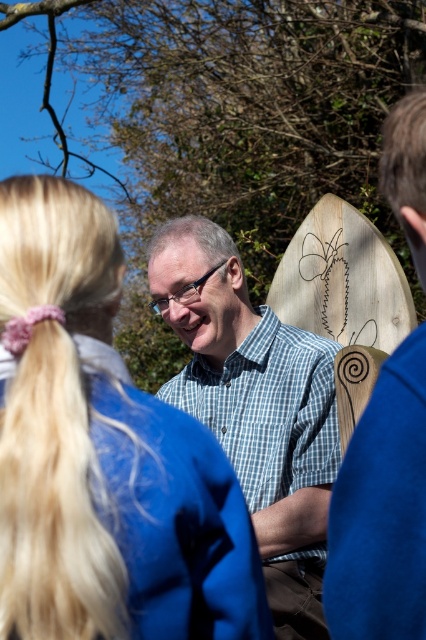
Does point (138, 604) lie behind point (397, 186)?

No, it is in front of (397, 186).

At what (x,y) coordinates should I click in order to perform the action: click on blue fabric at center. Please return your answer as a coordinate pair (x, y). The width and height of the screenshot is (426, 640). Looking at the image, I should click on (103, 454).

The image size is (426, 640). What do you see at coordinates (103, 454) in the screenshot?
I see `blue fabric at center` at bounding box center [103, 454].

Where is `blue fabric at center`? This screenshot has width=426, height=640. blue fabric at center is located at coordinates (103, 454).

Which is in front, point (115, 452) or point (325, 513)?

Positioned in front is point (115, 452).

Does point (46, 403) come in front of point (155, 278)?

Yes, point (46, 403) is closer to viewer.

What are the coordinates of `blue fabric at center` in the screenshot? It's located at (103, 454).

You are a GUI agent. You are given a task and a screenshot of the screen. Output one action in this format:
    pyautogui.click(x=<x>, y=<y>)
    Task: Click on the blue fabric at center
    
    Given the screenshot: What is the action you would take?
    pyautogui.click(x=103, y=454)

You are a GUI agent. You are given a task and a screenshot of the screen. Output one action in this format:
    pyautogui.click(x=<x>, y=<y>)
    Task: Click on the blue fabric at center
    
    Given the screenshot: What is the action you would take?
    pyautogui.click(x=103, y=454)